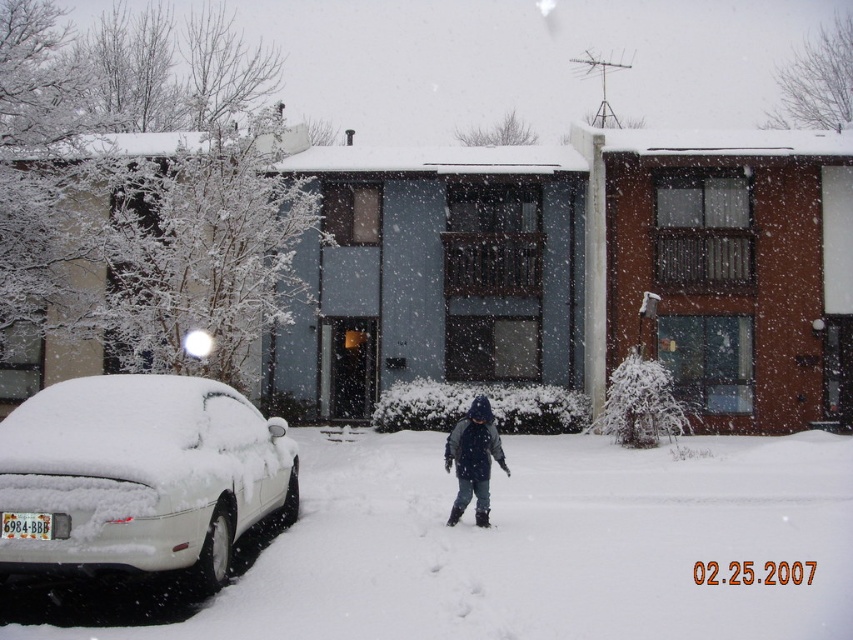
You are a delivery person trying to reach a house located at the right side of the image. You see the white matte car at left blocking your path. Can you go around it? Please explain your reasoning based on the car position.

The white matte car at left is positioned at coordinates (138, 476) in the image. Since the car is blocking your path to the right side, you can go around it either by moving to the left side of the car or the right side of the car. However, the exact feasibility depends on the surrounding environment not described here.

You are a delivery person who needs to park your van 5 meters away from the white matte car at left. Based on the scene, can you park your van in this spot without violating the parking rules?

The white matte car at left is 6.03 meters from the camera, so parking your van 5 meters away from it would place it 1.03 meters behind the white matte car at left. Since parking too close to another vehicle is typically against parking rules, you should not park there.

You are a delivery person trying to deliver a package to the house in the image. You see the white matte car at left and the dark blue knit hat at center. Which object is taller?

The white matte car at left is much taller than the dark blue knit hat at center.